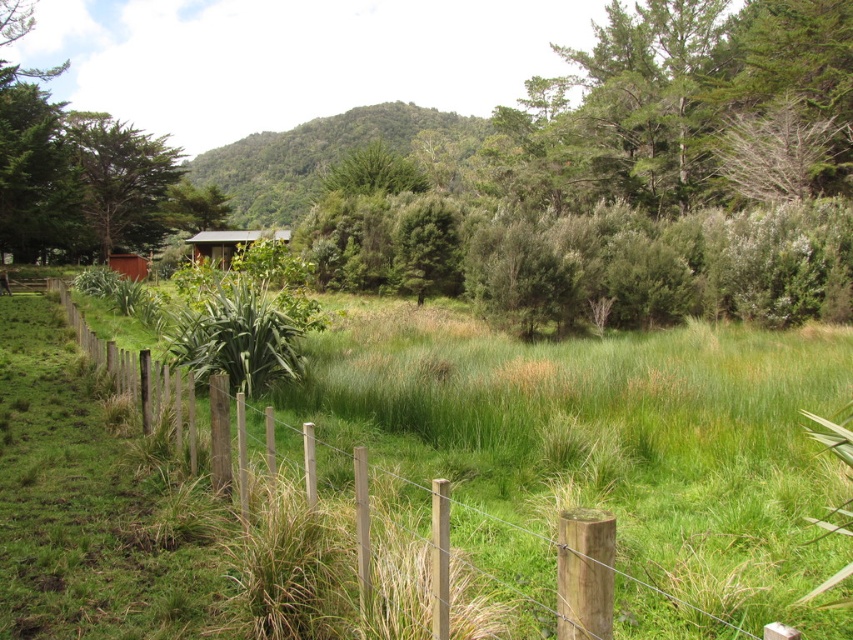
Question: Which point is closer to the camera?

Choices:
 (A) (416, 113)
 (B) (141, 276)
 (C) (70, 177)

Answer: (C)

Question: Can you confirm if green leafy hillside at upper center is positioned to the left of brown wooden hut at center-left?

Choices:
 (A) no
 (B) yes

Answer: (B)

Question: Which point is farther from the camera taking this photo?

Choices:
 (A) (416, 129)
 (B) (106, 205)
 (C) (42, 157)

Answer: (A)

Question: Among these objects, which one is farthest from the camera?

Choices:
 (A) brown wooden hut at center-left
 (B) green leafy hillside at upper center
 (C) green textured tree at upper left

Answer: (B)

Question: In this image, where is green leafy tree at upper left located relative to brown wooden hut at center-left?

Choices:
 (A) below
 (B) above

Answer: (B)

Question: Is green leafy shrub at center smaller than green leafy hillside at upper center?

Choices:
 (A) yes
 (B) no

Answer: (A)